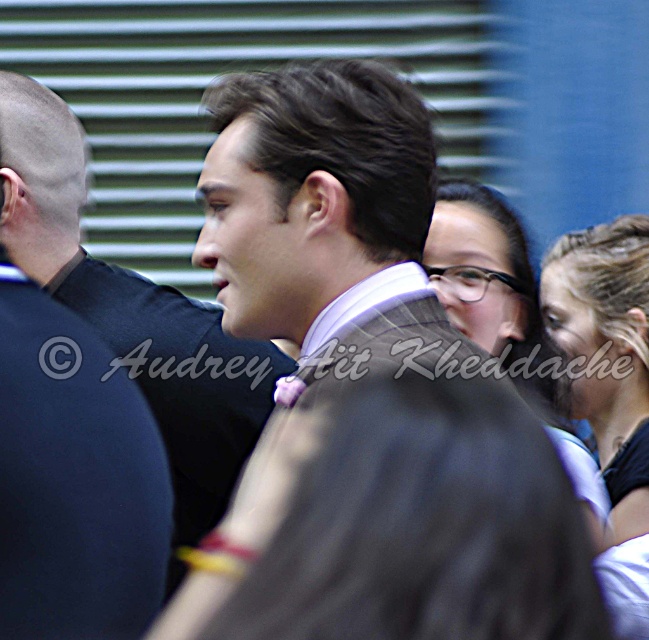
Question: Which point is closer to the camera taking this photo?

Choices:
 (A) (191, 564)
 (B) (202, 316)
 (C) (535, 317)
 (D) (624, 438)

Answer: (A)

Question: Estimate the real-world distances between objects in this image. Which object is farther from the matte gray suit at center?

Choices:
 (A) matte black hair at upper center
 (B) blonde hair at center
 (C) satin brown suit at center

Answer: (C)

Question: From the image, what is the correct spatial relationship of satin brown suit at center in relation to matte black hair at upper center?

Choices:
 (A) left
 (B) right

Answer: (A)

Question: Estimate the real-world distances between objects in this image. Which object is farther from the satin brown suit at center?

Choices:
 (A) matte black hair at upper center
 (B) blonde hair at center

Answer: (B)

Question: Is blonde hair at center closer to camera compared to matte black hair at upper center?

Choices:
 (A) no
 (B) yes

Answer: (A)

Question: Does matte gray suit at center appear under matte black hair at upper center?

Choices:
 (A) no
 (B) yes

Answer: (A)